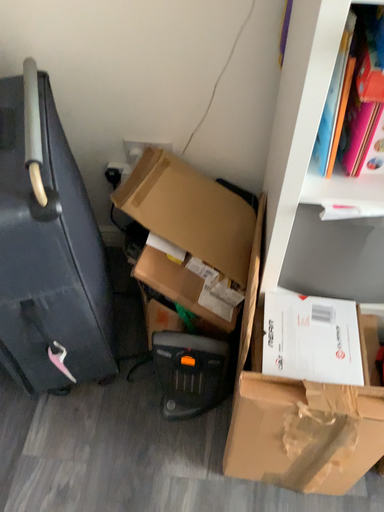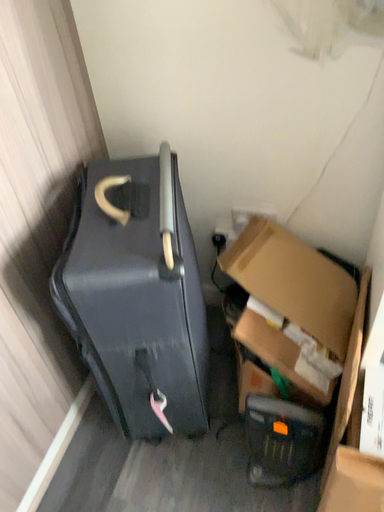
Question: Which way did the camera rotate in the video?

Choices:
 (A) rotated right
 (B) rotated left

Answer: (B)